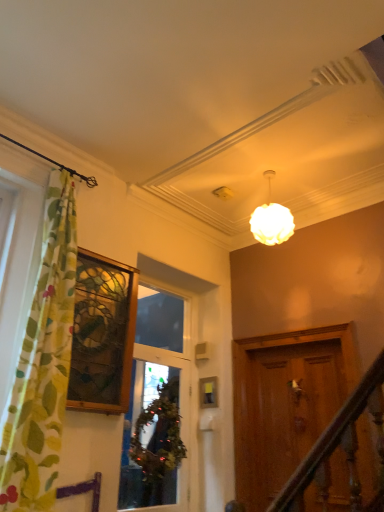
Question: From a real-world perspective, does matte white globe at upper center stand above green leafy wreath at center?

Choices:
 (A) no
 (B) yes

Answer: (B)

Question: Can you confirm if matte white globe at upper center is shorter than green leafy wreath at center?

Choices:
 (A) no
 (B) yes

Answer: (B)

Question: Can you confirm if matte white globe at upper center is smaller than green leafy wreath at center?

Choices:
 (A) no
 (B) yes

Answer: (B)

Question: Is green leafy wreath at center completely or partially inside matte white globe at upper center?

Choices:
 (A) no
 (B) yes

Answer: (A)

Question: Could you tell me if matte white globe at upper center is facing green leafy wreath at center?

Choices:
 (A) yes
 (B) no

Answer: (B)

Question: Looking at the image, does green fabric wreath at center, which is the 2th window in left-to-right order, seem bigger or smaller compared to green floral fabric curtain at left?

Choices:
 (A) small
 (B) big

Answer: (A)

Question: From the image's perspective, is green fabric wreath at center, positioned as the 1th window in right-to-left order, located above or below green floral fabric curtain at left?

Choices:
 (A) above
 (B) below

Answer: (B)

Question: Is green fabric wreath at center, which is the 2th window in left-to-right order, inside the boundaries of green floral fabric curtain at left, or outside?

Choices:
 (A) outside
 (B) inside

Answer: (A)

Question: From a real-world perspective, is green fabric wreath at center, which is the 2th window in left-to-right order, physically located above or below green floral fabric curtain at left?

Choices:
 (A) below
 (B) above

Answer: (A)

Question: Is green leafy wreath at center situated inside stained glass window at left, which is the second window from right to left, or outside?

Choices:
 (A) inside
 (B) outside

Answer: (B)

Question: Considering the positions of point (145, 475) and point (107, 307), is point (145, 475) closer or farther from the camera than point (107, 307)?

Choices:
 (A) farther
 (B) closer

Answer: (A)

Question: Relative to stained glass window at left, which appears as the 1th window when viewed from the left, is green leafy wreath at center in front or behind?

Choices:
 (A) front
 (B) behind

Answer: (B)

Question: From the image's perspective, is green leafy wreath at center above or below stained glass window at left, which is the second window from right to left?

Choices:
 (A) above
 (B) below

Answer: (B)

Question: Considering the relative positions of green leafy wreath at center and green fabric wreath at center, which is the 2th window in left-to-right order, in the image provided, is green leafy wreath at center to the left or to the right of green fabric wreath at center, which is the 2th window in left-to-right order,?

Choices:
 (A) left
 (B) right

Answer: (B)

Question: Is green leafy wreath at center inside or outside of green fabric wreath at center, positioned as the 1th window in right-to-left order?

Choices:
 (A) outside
 (B) inside

Answer: (A)